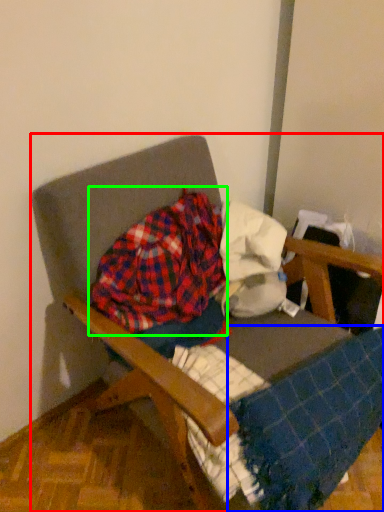
Question: Estimate the real-world distances between objects in this image. Which object is farther from chair (highlighted by a red box), blanket (highlighted by a blue box) or flannel (highlighted by a green box)?

Choices:
 (A) blanket
 (B) flannel

Answer: (A)